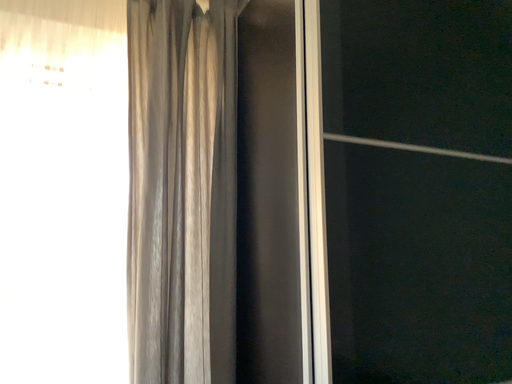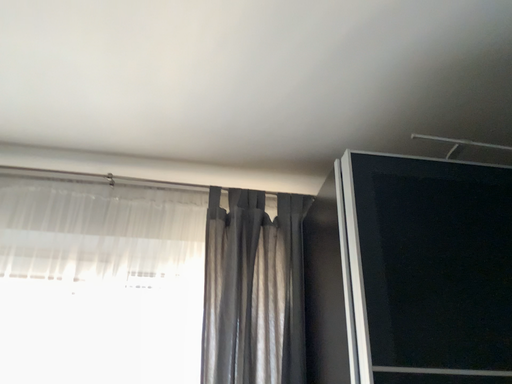
Question: How did the camera likely rotate when shooting the video?

Choices:
 (A) rotated left
 (B) rotated right

Answer: (A)